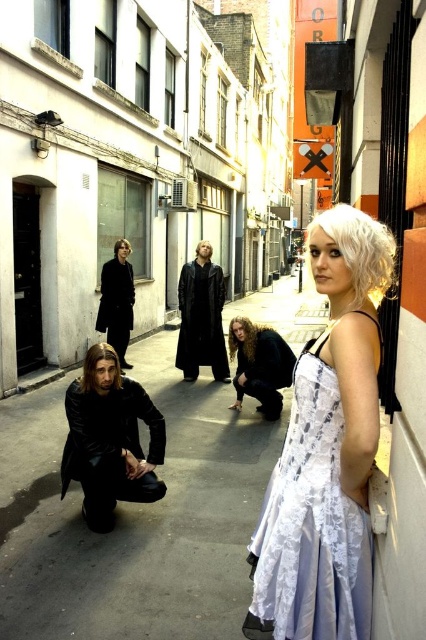
You are a photographer setting up for a group shot in an urban alleyway. You notice the white lace dress at center and the blonde hair at center. Which of these two elements do you think occupies more horizontal space in the frame?

The white lace dress at center might be wider than blonde hair at center, so it likely occupies more horizontal space in the frame.